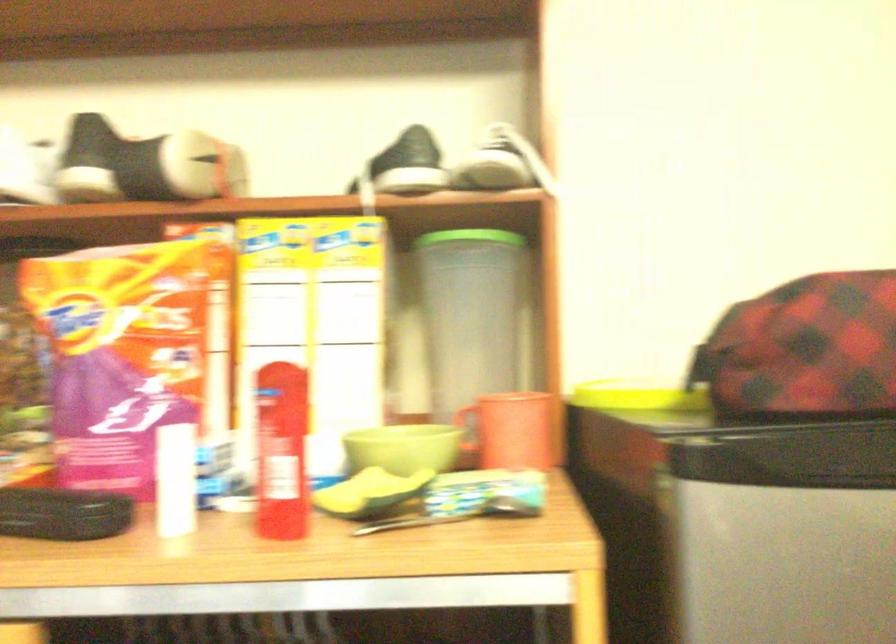
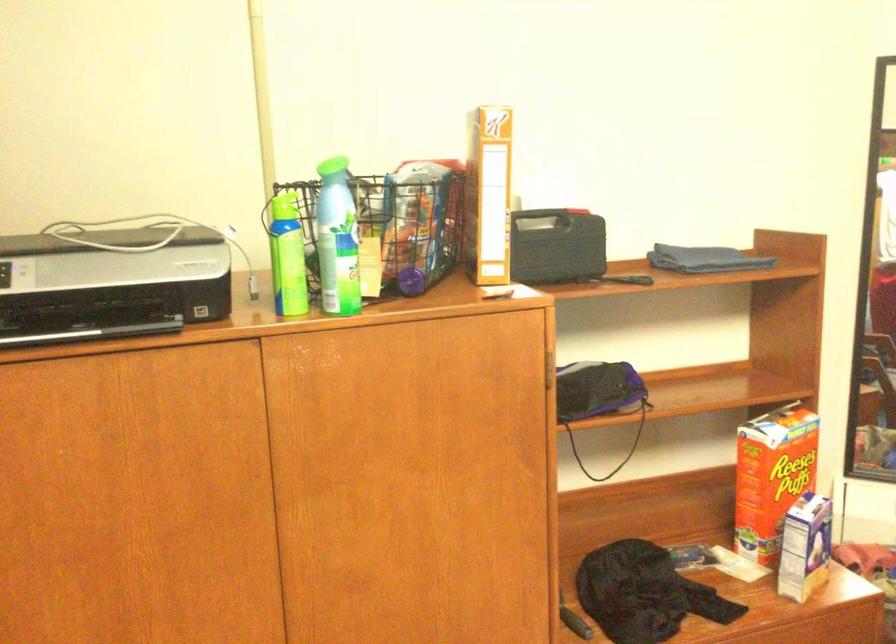
Question: The camera is either moving clockwise (left) or counter-clockwise (right) around the object. The first image is from the beginning of the video and the second image is from the end. Is the camera moving left or right when shooting the video?

Choices:
 (A) Left
 (B) Right

Answer: (A)